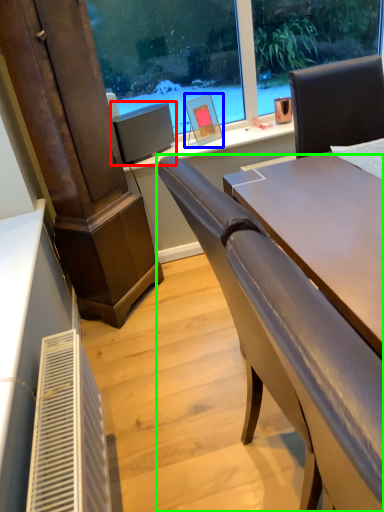
Question: Which object is the farthest from computer monitor (highlighted by a red box)? Choose among these: picture frame (highlighted by a blue box) or chair (highlighted by a green box).

Choices:
 (A) picture frame
 (B) chair

Answer: (B)